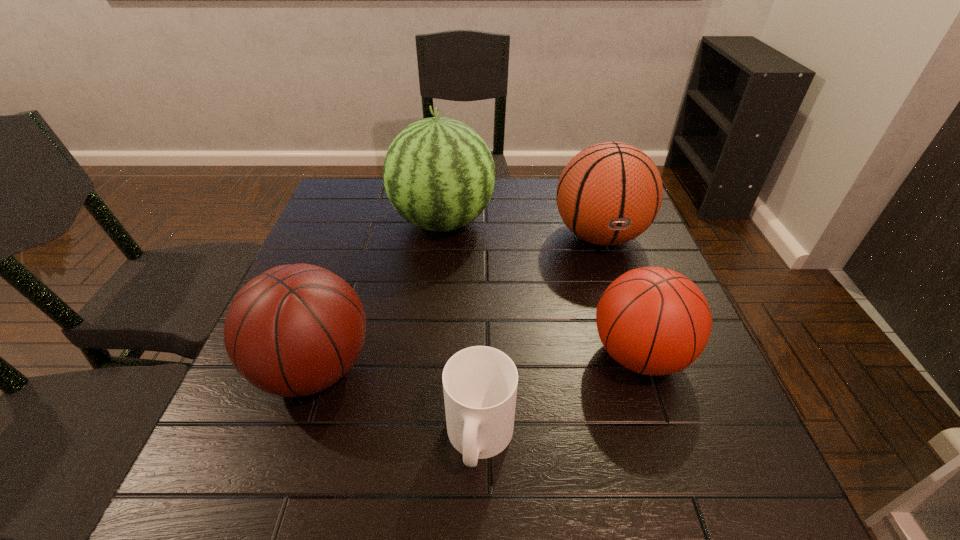
Identify the location of free space between the farthest basketball and the tallest object. The width and height of the screenshot is (960, 540). (521, 229).

Identify which object is located as the second nearest to the leftmost basketball. Please provide its 2D coordinates. Your answer should be formatted as a tuple, i.e. [(x, y)], where the tuple contains the x and y coordinates of a point satisfying the conditions above.

[(439, 175)]

You are a GUI agent. You are given a task and a screenshot of the screen. Output one action in this format:
    pyautogui.click(x=<x>, y=<y>)
    Task: Click on the object that can be found as the third closest to the farthest basketball
    The height and width of the screenshot is (540, 960).
    Given the screenshot: What is the action you would take?
    pyautogui.click(x=480, y=383)

Where is `basketball that is the third closest to the watermelon`? The image size is (960, 540). basketball that is the third closest to the watermelon is located at coordinates (655, 321).

Choose which basketball is the third nearest neighbor to the shortest object. Please provide its 2D coordinates. Your answer should be formatted as a tuple, i.e. [(x, y)], where the tuple contains the x and y coordinates of a point satisfying the conditions above.

[(609, 193)]

At what (x,y) coordinates should I click in order to perform the action: click on free space that satisfies the following two spatial constraints: 1. on the back side of the leftmost basketball; 2. on the left side of the watermelon. Please return your answer as a coordinate pair (x, y). This screenshot has width=960, height=540. Looking at the image, I should click on (364, 222).